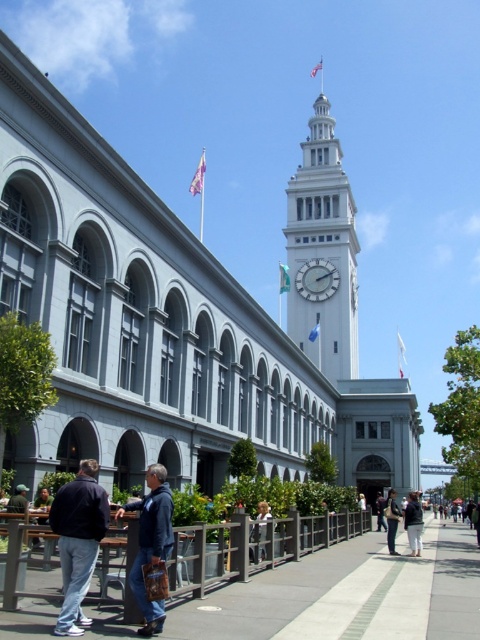
You are a tourist standing on the walkway and want to take a photo of the white glossy clock at upper center and the dark blue jeans at center. Which object should you focus on first if you want to capture both in a single frame without moving the camera?

You should focus on the dark blue jeans at center first because the white glossy clock at upper center is shorter than the dark blue jeans at center, so adjusting the camera angle to include the taller dark blue jeans will naturally include the shorter clock in the frame.

In the scene shown: You are standing at the dark blue jeans at center position in the image. You want to reach the white glossy clock at upper center. Given that your walking speed is 1.5 meters per second, how many seconds will it take you to reach the clock?

The distance between the white glossy clock at upper center and dark blue jeans at center is 40.85 meters. At a speed of 1.5 meters per second, it would take approximately 27.23 seconds to reach the clock.

You are a tour guide leading a group near the historical building. You notice two jackets left on the walkway. The jackets are the dark blue jacket at lower left and the denim jacket at lower center. Which jacket is shorter in height?

The dark blue jacket at lower left is not as tall as the denim jacket at lower center, so the dark blue jacket at lower left is shorter in height.